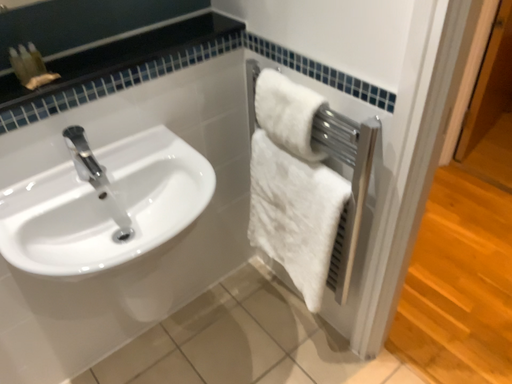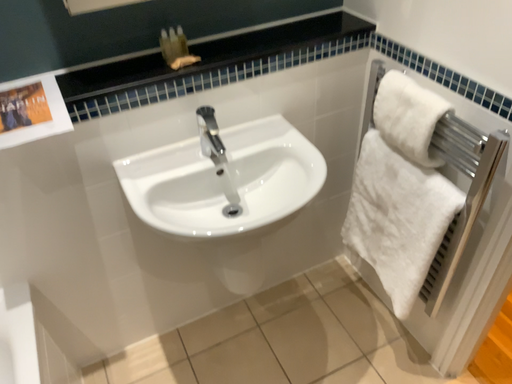
Question: Which way did the camera rotate in the video?

Choices:
 (A) rotated right
 (B) rotated left

Answer: (B)